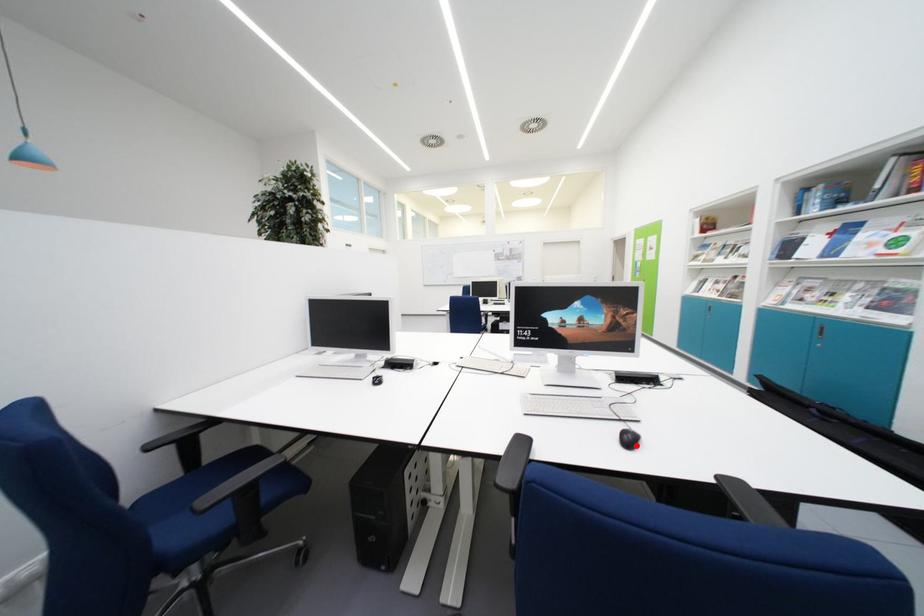
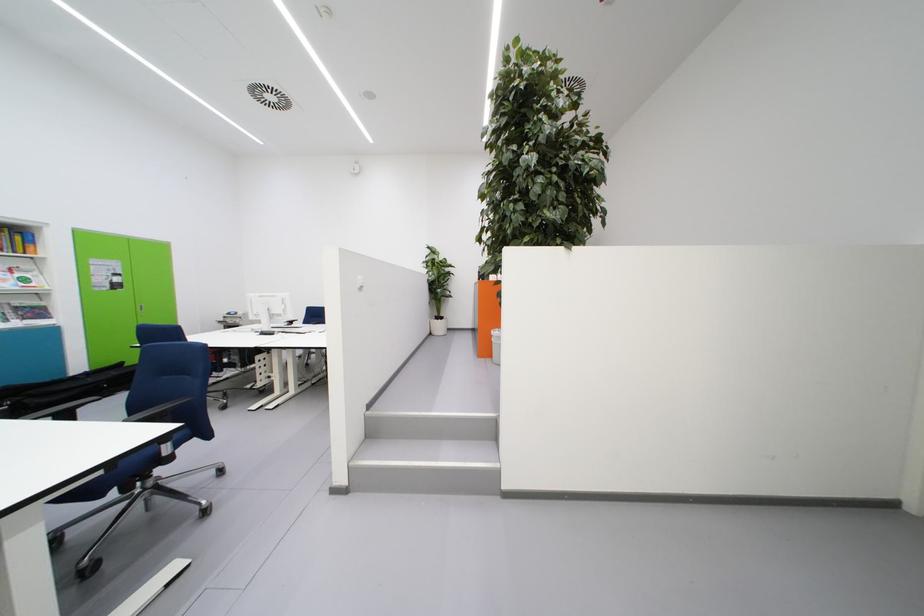
Question: I am providing you with two images of the same scene from different viewpoints. A red point is marked on the first image. Is the red point's position out of view in image 2?

Choices:
 (A) Yes
 (B) No

Answer: (A)